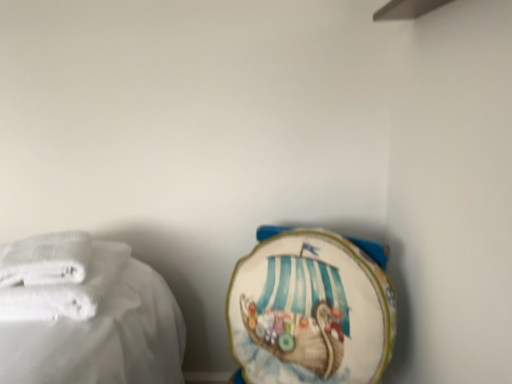
Question: Can you confirm if white fabric towel at lower right, which is counted as the 3th towel, starting from the left, is thinner than white soft towel at left, placed as the 3th towel when sorted from right to left?

Choices:
 (A) no
 (B) yes

Answer: (B)

Question: From the image's perspective, is white fabric towel at lower right, which is the 1th towel in right-to-left order, beneath white soft towel at left, placed as the 3th towel when sorted from right to left?

Choices:
 (A) no
 (B) yes

Answer: (B)

Question: Is white fabric towel at lower right, which is the 1th towel in right-to-left order, closer to camera compared to white soft towel at left, placed as the 3th towel when sorted from right to left?

Choices:
 (A) no
 (B) yes

Answer: (A)

Question: Is white fabric towel at lower right, which is the 1th towel in right-to-left order, positioned behind white soft towel at left, which is the 1th towel from left to right?

Choices:
 (A) no
 (B) yes

Answer: (B)

Question: Would you consider white fabric towel at lower right, which is the 1th towel in right-to-left order, to be distant from white soft towel at left, placed as the 3th towel when sorted from right to left?

Choices:
 (A) no
 (B) yes

Answer: (A)

Question: In terms of height, does white fabric towel at lower right, which is the 1th towel in right-to-left order, look taller or shorter compared to white soft towel at left, which is the 1th towel from left to right?

Choices:
 (A) short
 (B) tall

Answer: (B)

Question: From the image's perspective, relative to white soft towel at left, which is the 1th towel from left to right, is white fabric towel at lower right, which is the 1th towel in right-to-left order, above or below?

Choices:
 (A) above
 (B) below

Answer: (B)

Question: From a real-world perspective, is white fabric towel at lower right, which is the 1th towel in right-to-left order, physically located above or below white soft towel at left, placed as the 3th towel when sorted from right to left?

Choices:
 (A) below
 (B) above

Answer: (A)

Question: In terms of width, does white fabric towel at lower right, which is counted as the 3th towel, starting from the left, look wider or thinner when compared to white soft towel at left, placed as the 3th towel when sorted from right to left?

Choices:
 (A) wide
 (B) thin

Answer: (B)

Question: In terms of size, does white fabric towel at lower right, which is counted as the 3th towel, starting from the left, appear bigger or smaller than white soft towel at left, positioned as the second towel in left-to-right order?

Choices:
 (A) small
 (B) big

Answer: (B)

Question: From the image's perspective, is white fabric towel at lower right, which is counted as the 3th towel, starting from the left, located above or below white soft towel at left, the 2th towel when ordered from right to left?

Choices:
 (A) above
 (B) below

Answer: (B)

Question: Is white fabric towel at lower right, which is counted as the 3th towel, starting from the left, inside the boundaries of white soft towel at left, positioned as the second towel in left-to-right order, or outside?

Choices:
 (A) inside
 (B) outside

Answer: (B)

Question: In the image, is white fabric towel at lower right, which is the 1th towel in right-to-left order, positioned in front of or behind white soft towel at left, positioned as the second towel in left-to-right order?

Choices:
 (A) behind
 (B) front

Answer: (B)

Question: Is white soft towel at left, which is the 1th towel from left to right, taller or shorter than white fabric towel at lower right, which is counted as the 3th towel, starting from the left?

Choices:
 (A) short
 (B) tall

Answer: (A)

Question: Is white soft towel at left, placed as the 3th towel when sorted from right to left, to the left or to the right of white fabric towel at lower right, which is counted as the 3th towel, starting from the left, in the image?

Choices:
 (A) right
 (B) left

Answer: (B)